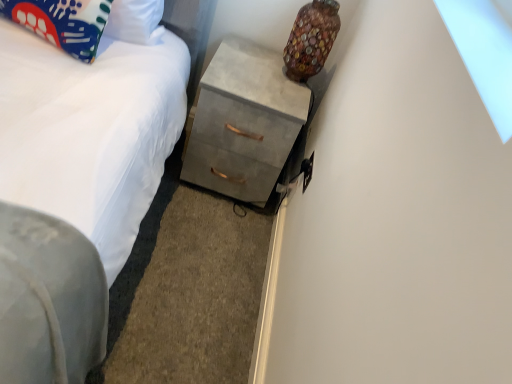
Describe the element at coordinates (311, 39) in the screenshot. The width and height of the screenshot is (512, 384). I see `multicolored glass vase at upper right` at that location.

Measure the distance between matte fabric pillow at upper left and camera.

matte fabric pillow at upper left and camera are 4.22 feet apart from each other.

Identify the location of concrete gray chest of drawers at center. (243, 122).

Describe the element at coordinates (243, 122) in the screenshot. I see `concrete gray chest of drawers at center` at that location.

The width and height of the screenshot is (512, 384). Find the location of `multicolored glass vase at upper right`. multicolored glass vase at upper right is located at coordinates (311, 39).

From the picture: From a real-world perspective, does matte fabric pillow at upper left sit lower than concrete gray chest of drawers at center?

No, from a real-world perspective, matte fabric pillow at upper left is not under concrete gray chest of drawers at center.

From the image's perspective, is matte fabric pillow at upper left located above concrete gray chest of drawers at center?

Yes, from the image's perspective, matte fabric pillow at upper left is on top of concrete gray chest of drawers at center.

Can we say matte fabric pillow at upper left lies outside concrete gray chest of drawers at center?

Answer: Yes, matte fabric pillow at upper left is outside of concrete gray chest of drawers at center.

Can you tell me how much matte fabric pillow at upper left and concrete gray chest of drawers at center differ in facing direction?

matte fabric pillow at upper left and concrete gray chest of drawers at center are facing 8.33 degrees away from each other.

How many degrees apart are the facing directions of concrete gray chest of drawers at center and white fabric bed at lower left?

There is a 178-degree angle between the facing directions of concrete gray chest of drawers at center and white fabric bed at lower left.

Is concrete gray chest of drawers at center taller than white fabric bed at lower left?

Yes.

From a real-world perspective, which object stands above the other?

concrete gray chest of drawers at center.

Is white fabric bed at lower left at the back of concrete gray chest of drawers at center?

No, concrete gray chest of drawers at center's orientation is not away from white fabric bed at lower left.

Looking at this image, can we say multicolored glass vase at upper right lies outside white fabric bed at lower left?

That's correct, multicolored glass vase at upper right is outside of white fabric bed at lower left.

From the image's perspective, is multicolored glass vase at upper right located beneath white fabric bed at lower left?

No.

Between multicolored glass vase at upper right and white fabric bed at lower left, which one has larger size?

Bigger between the two is white fabric bed at lower left.

Can you see white fabric bed at lower left touching matte fabric pillow at upper left?

No, white fabric bed at lower left is not with matte fabric pillow at upper left.

Considering the relative sizes of white fabric bed at lower left and matte fabric pillow at upper left in the image provided, is white fabric bed at lower left shorter than matte fabric pillow at upper left?

Indeed, white fabric bed at lower left has a lesser height compared to matte fabric pillow at upper left.

Identify the location of pillow above the white fabric bed at lower left (from a real-world perspective). The height and width of the screenshot is (384, 512). (63, 22).

Consider the image. Is matte fabric pillow at upper left at the back of white fabric bed at lower left?

No, white fabric bed at lower left is not facing the opposite direction of matte fabric pillow at upper left.

From a real-world perspective, is white fabric bed at lower left physically below multicolored glass vase at upper right?

Correct, in the physical world, white fabric bed at lower left is lower than multicolored glass vase at upper right.

Where is `lamp behind the white fabric bed at lower left`? lamp behind the white fabric bed at lower left is located at coordinates (311, 39).

From the image's perspective, who appears lower, white fabric bed at lower left or multicolored glass vase at upper right?

From the image's view, white fabric bed at lower left is below.

Which object is more forward, multicolored glass vase at upper right or matte fabric pillow at upper left?

matte fabric pillow at upper left.

Can you tell me how much multicolored glass vase at upper right and matte fabric pillow at upper left differ in facing direction?

The angular difference between multicolored glass vase at upper right and matte fabric pillow at upper left is 8.62 degrees.

Is multicolored glass vase at upper right taller than matte fabric pillow at upper left?

Indeed, multicolored glass vase at upper right has a greater height compared to matte fabric pillow at upper left.

From a real-world perspective, which object stands above the other?

In real-world perspective, multicolored glass vase at upper right is above.

From the picture: Is matte fabric pillow at upper left facing away from white fabric bed at lower left?

No, matte fabric pillow at upper left is not facing away from white fabric bed at lower left.

Would you say matte fabric pillow at upper left is inside or outside white fabric bed at lower left?

matte fabric pillow at upper left is not enclosed by white fabric bed at lower left.

From a real-world perspective, is matte fabric pillow at upper left beneath white fabric bed at lower left?

No.

Identify the location of bed below the matte fabric pillow at upper left (from a real-world perspective). The height and width of the screenshot is (384, 512). (90, 132).

Where is `pillow above the concrete gray chest of drawers at center (from the image's perspective)`? pillow above the concrete gray chest of drawers at center (from the image's perspective) is located at coordinates (63, 22).

Where is `the chest of drawers behind the white fabric bed at lower left`? The height and width of the screenshot is (384, 512). the chest of drawers behind the white fabric bed at lower left is located at coordinates (243, 122).

When comparing their distances from matte fabric pillow at upper left, does concrete gray chest of drawers at center or white fabric bed at lower left seem further?

concrete gray chest of drawers at center is further to matte fabric pillow at upper left.

Looking at the image, which one is located closer to concrete gray chest of drawers at center, white fabric bed at lower left or matte fabric pillow at upper left?

white fabric bed at lower left is positioned closer to the anchor concrete gray chest of drawers at center.

When comparing their distances from white fabric bed at lower left, does concrete gray chest of drawers at center or multicolored glass vase at upper right seem further?

multicolored glass vase at upper right is further to white fabric bed at lower left.

Consider the image. Looking at the image, which one is located closer to multicolored glass vase at upper right, matte fabric pillow at upper left or concrete gray chest of drawers at center?

The object closer to multicolored glass vase at upper right is concrete gray chest of drawers at center.

From the picture: Estimate the real-world distances between objects in this image. Which object is closer to multicolored glass vase at upper right, concrete gray chest of drawers at center or matte fabric pillow at upper left?

Among the two, concrete gray chest of drawers at center is located nearer to multicolored glass vase at upper right.

Looking at the image, which one is located closer to multicolored glass vase at upper right, white fabric bed at lower left or concrete gray chest of drawers at center?

concrete gray chest of drawers at center is closer to multicolored glass vase at upper right.

Considering their positions, is multicolored glass vase at upper right positioned further to white fabric bed at lower left than matte fabric pillow at upper left?

multicolored glass vase at upper right is positioned further to the anchor white fabric bed at lower left.

From the image, which object appears to be farther from concrete gray chest of drawers at center, white fabric bed at lower left or multicolored glass vase at upper right?

white fabric bed at lower left.

You are a GUI agent. You are given a task and a screenshot of the screen. Output one action in this format:
    pyautogui.click(x=<x>, y=<y>)
    Task: Click on the bed between matte fabric pillow at upper left and multicolored glass vase at upper right in the horizontal direction
    This screenshot has width=512, height=384.
    Given the screenshot: What is the action you would take?
    pyautogui.click(x=90, y=132)

The image size is (512, 384). I want to click on the chest of drawers located between matte fabric pillow at upper left and multicolored glass vase at upper right in the left-right direction, so click(x=243, y=122).

Find the location of `chest of drawers between matte fabric pillow at upper left and white fabric bed at lower left from top to bottom`. chest of drawers between matte fabric pillow at upper left and white fabric bed at lower left from top to bottom is located at coordinates click(243, 122).

At what (x,y) coordinates should I click in order to perform the action: click on chest of drawers between multicolored glass vase at upper right and white fabric bed at lower left in the vertical direction. Please return your answer as a coordinate pair (x, y). Looking at the image, I should click on (243, 122).